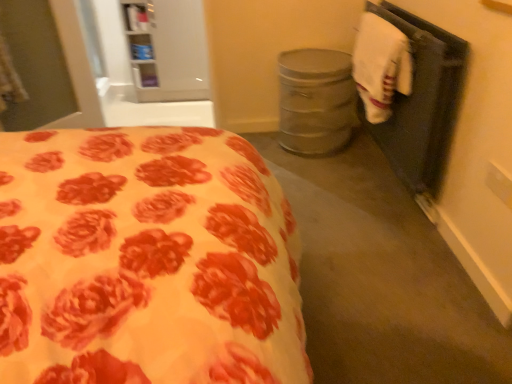
Question: Which is correct: white fabric at right is inside white cotton hand towel at right, or outside of it?

Choices:
 (A) inside
 (B) outside

Answer: (B)

Question: Considering the positions of white fabric at right and white cotton hand towel at right in the image, is white fabric at right wider or thinner than white cotton hand towel at right?

Choices:
 (A) thin
 (B) wide

Answer: (A)

Question: From the image's perspective, is white fabric at right positioned above or below white cotton hand towel at right?

Choices:
 (A) above
 (B) below

Answer: (B)

Question: Is white cotton hand towel at right bigger or smaller than white fabric at right?

Choices:
 (A) big
 (B) small

Answer: (B)

Question: In terms of height, does white cotton hand towel at right look taller or shorter compared to white fabric at right?

Choices:
 (A) short
 (B) tall

Answer: (A)

Question: From the image's perspective, is white cotton hand towel at right positioned above or below white fabric at right?

Choices:
 (A) above
 (B) below

Answer: (A)

Question: Is point (382, 24) positioned closer to the camera than point (424, 112)?

Choices:
 (A) farther
 (B) closer

Answer: (A)